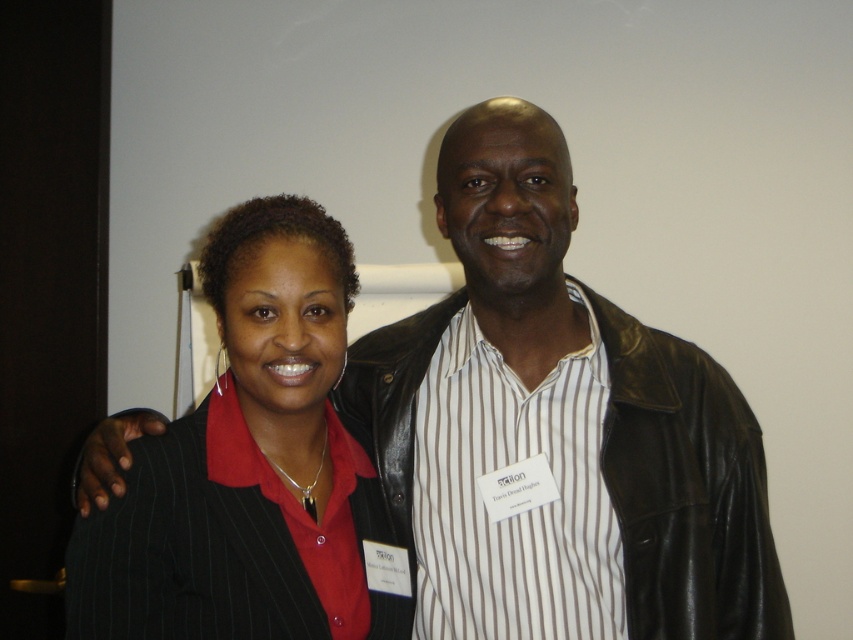
Question: Which object is closer to the camera taking this photo?

Choices:
 (A) black pinstripe blazer at center
 (B) black leather jacket at center

Answer: (A)

Question: Which point appears closest to the camera in this image?

Choices:
 (A) (712, 572)
 (B) (288, 458)

Answer: (B)

Question: In this image, where is black leather jacket at center located relative to black pinstripe blazer at center?

Choices:
 (A) left
 (B) right

Answer: (B)

Question: Does black leather jacket at center have a smaller size compared to black pinstripe blazer at center?

Choices:
 (A) no
 (B) yes

Answer: (A)

Question: Does black leather jacket at center appear on the left side of black pinstripe blazer at center?

Choices:
 (A) no
 (B) yes

Answer: (A)